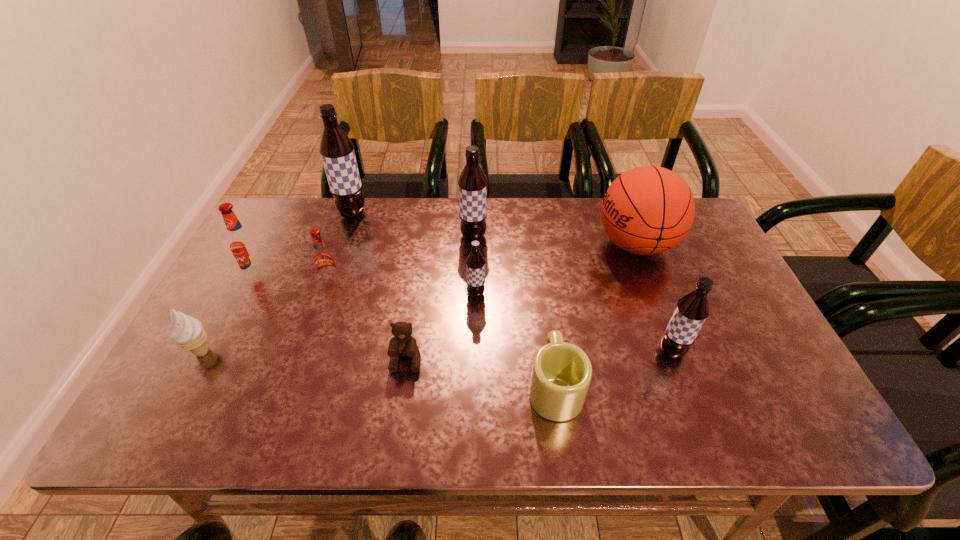
In order to click on the tallest object in this screenshot , I will do `click(337, 152)`.

The width and height of the screenshot is (960, 540). Identify the location of the farthest root beer. (337, 152).

Where is `the second biggest brown root beer`? the second biggest brown root beer is located at coordinates (472, 182).

Locate an element on the screen. This screenshot has height=540, width=960. the ninth shortest object is located at coordinates point(472,182).

The image size is (960, 540). Find the location of `basketball`. basketball is located at coordinates (647, 210).

This screenshot has width=960, height=540. What are the coordinates of `the bigger red root beer` in the screenshot? It's located at (242, 243).

Find the location of a particular element. the left red root beer is located at coordinates (242, 243).

At what (x,y) coordinates should I click in order to perform the action: click on the second smallest brown root beer. Please return your answer as a coordinate pair (x, y). Looking at the image, I should click on (691, 311).

Where is `the rightmost brown root beer`? The height and width of the screenshot is (540, 960). the rightmost brown root beer is located at coordinates (691, 311).

Find the location of `the smaller red root beer`. the smaller red root beer is located at coordinates point(323,258).